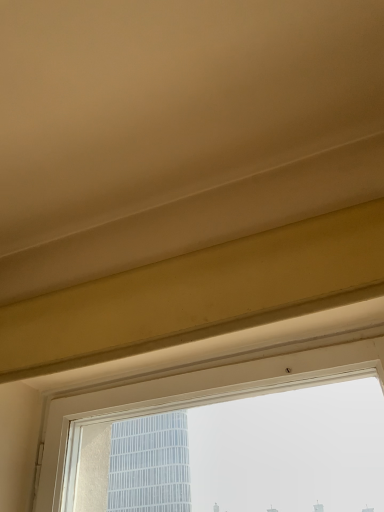
What is the approximate height of white plastic window at center?

white plastic window at center is 46.33 centimeters tall.

Identify the location of white plastic window at center. (190, 395).

In order to face white plastic window at center, should I rotate leftwards or rightwards?

You should rotate right by 0.735 degrees.

This screenshot has width=384, height=512. What do you see at coordinates (190, 395) in the screenshot?
I see `white plastic window at center` at bounding box center [190, 395].

At what (x,y) coordinates should I click in order to perform the action: click on white plastic window at center. Please return your answer as a coordinate pair (x, y). Looking at the image, I should click on pos(190,395).